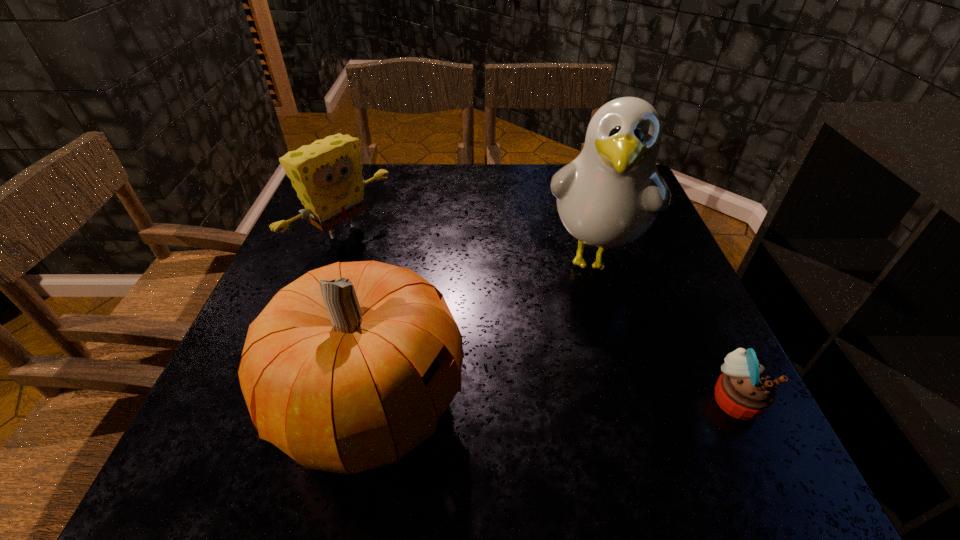
I want to click on vacant space located 0.320m on the face of the second shortest object, so click(x=478, y=328).

Where is `free space located 0.100m on the face of the second shortest object`? The image size is (960, 540). free space located 0.100m on the face of the second shortest object is located at coordinates (401, 279).

Identify the location of free location located on the face of the second shortest object. (482, 330).

Find the location of a particular element. object located at the far edge is located at coordinates (327, 175).

Identify the location of pumpkin at the near edge. The height and width of the screenshot is (540, 960). (348, 368).

Identify the location of muffin that is at the near edge. The height and width of the screenshot is (540, 960). (743, 391).

Find the location of a particular element. pumpkin that is at the left edge is located at coordinates (348, 368).

I want to click on sponge that is at the left edge, so pos(327,175).

The width and height of the screenshot is (960, 540). What are the coordinates of `muffin present at the right edge` in the screenshot? It's located at (743, 391).

Where is `gull located at the right edge`? gull located at the right edge is located at coordinates (610, 195).